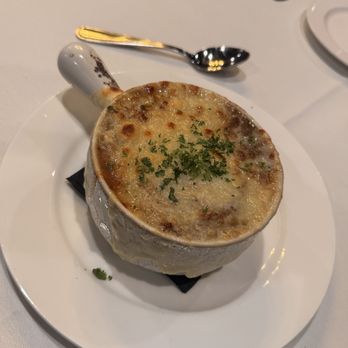
Where is `handle where you would pick up the bowl`? handle where you would pick up the bowl is located at coordinates (83, 70).